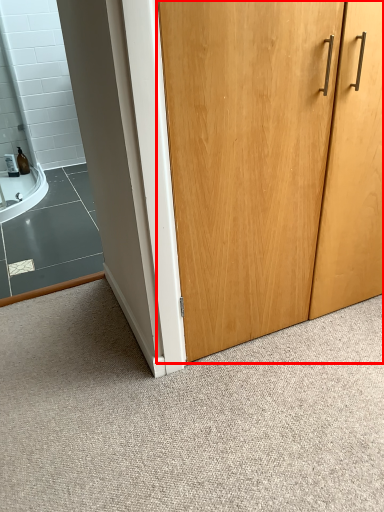
Question: Where is door (annotated by the red box) located in relation to granite in the image?

Choices:
 (A) right
 (B) left

Answer: (A)